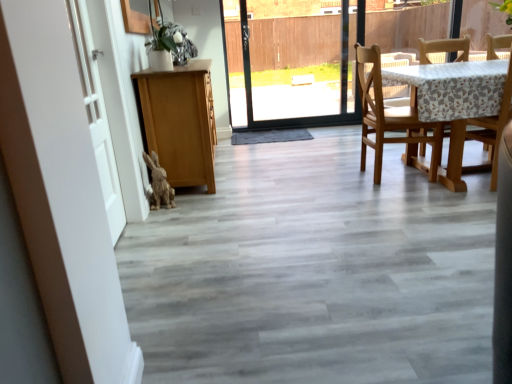
Question: Would you say fuzzy brown rabbit at lower left is to the left or to the right of wooden chair at right, the first chair in the right-to-left sequence, in the picture?

Choices:
 (A) right
 (B) left

Answer: (B)

Question: In terms of height, does fuzzy brown rabbit at lower left look taller or shorter compared to wooden chair at right, the 2th chair viewed from the left?

Choices:
 (A) tall
 (B) short

Answer: (B)

Question: Considering the real-world distances, which object is farthest from the white matte door at left?

Choices:
 (A) fuzzy brown rabbit at lower left
 (B) white matte barn door at left
 (C) light brown wooden chair at right, which is the 2th chair from right to left
 (D) wooden chair at right, the 2th chair viewed from the left

Answer: (D)

Question: Which of these objects is positioned farthest from the wooden chair at right, the first chair in the right-to-left sequence?

Choices:
 (A) white matte barn door at left
 (B) light brown wooden chair at right, which is the 2th chair from right to left
 (C) fuzzy brown rabbit at lower left
 (D) white matte door at left

Answer: (A)